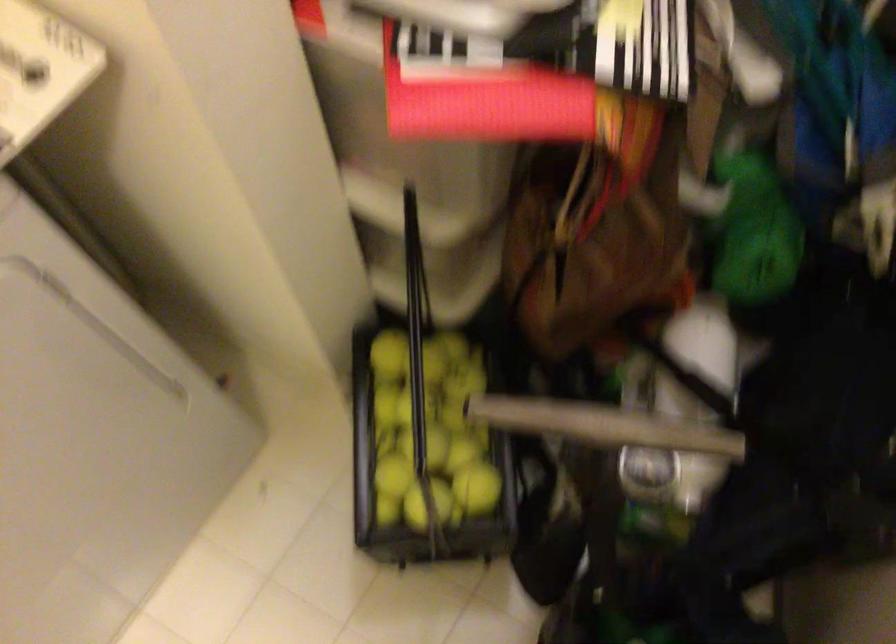
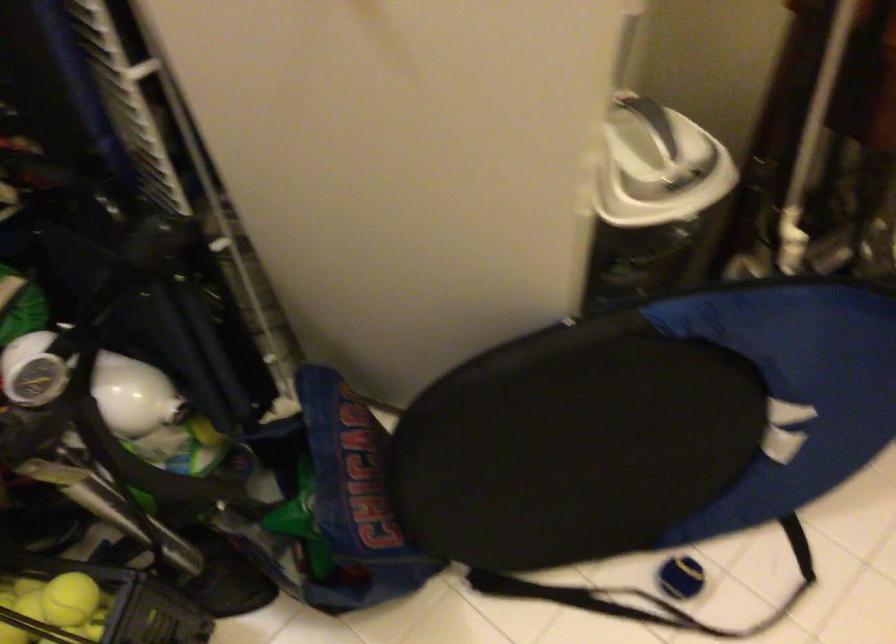
Question: The camera is either moving clockwise (left) or counter-clockwise (right) around the object. The first image is from the beginning of the video and the second image is from the end. Is the camera moving left or right when shooting the video?

Choices:
 (A) Left
 (B) Right

Answer: (A)